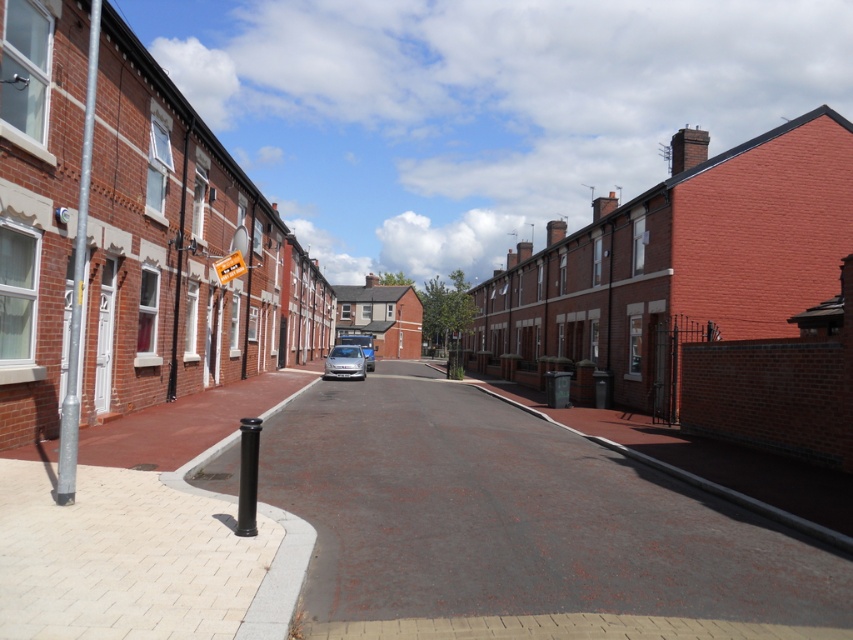
Which is more to the left, smooth asphalt road at center or satin silver car at center?

Positioned to the left is satin silver car at center.

Is smooth asphalt road at center shorter than satin silver car at center?

Correct, smooth asphalt road at center is not as tall as satin silver car at center.

Is point (496, 419) positioned before point (329, 355)?

Yes, point (496, 419) is in front of point (329, 355).

Where is `smooth asphalt road at center`? Image resolution: width=853 pixels, height=640 pixels. smooth asphalt road at center is located at coordinates (520, 528).

Is satin silver car at center closer to the viewer compared to yellow plastic street sign at center?

No, it is behind yellow plastic street sign at center.

Measure the distance between satin silver car at center and camera.

They are 29.03 meters apart.

Does point (361, 353) come in front of point (236, 266)?

No, (361, 353) is behind (236, 266).

I want to click on satin silver car at center, so click(x=345, y=362).

Is smooth asphalt road at center smaller than yellow plastic street sign at center?

Incorrect, smooth asphalt road at center is not smaller in size than yellow plastic street sign at center.

Describe the element at coordinates (520, 528) in the screenshot. This screenshot has width=853, height=640. I see `smooth asphalt road at center` at that location.

This screenshot has width=853, height=640. In order to click on smooth asphalt road at center in this screenshot , I will do `click(520, 528)`.